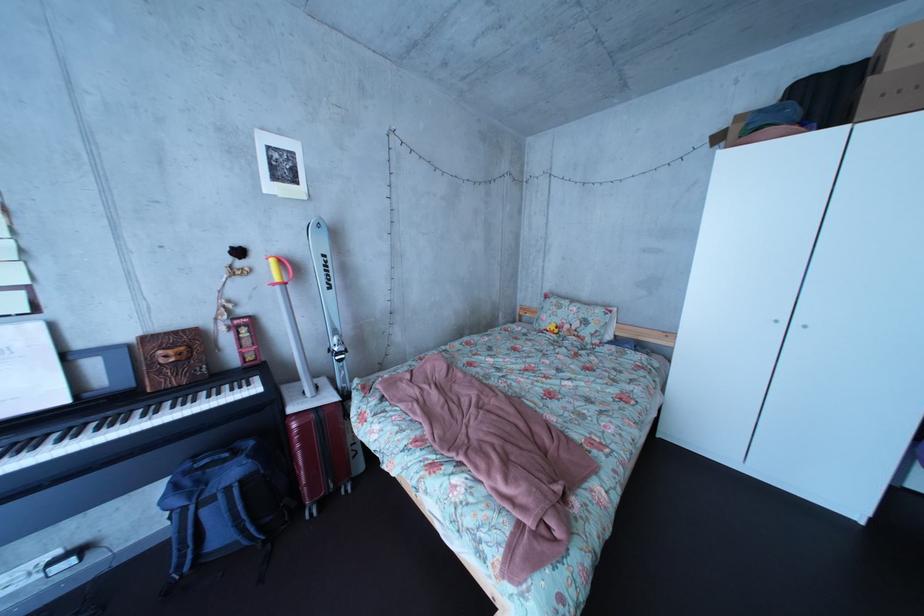
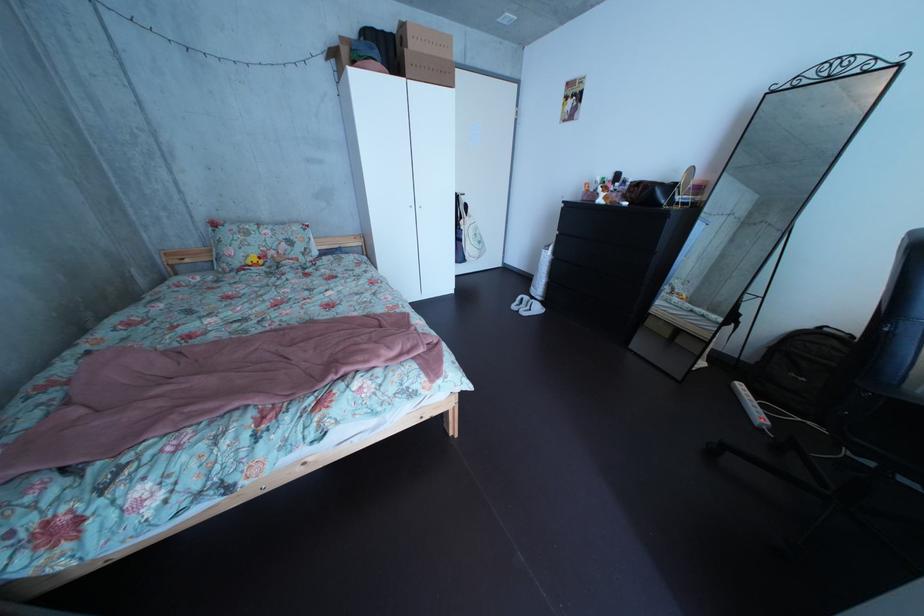
Based on the photo, the first image is from the beginning of the video and the second image is from the end. How did the camera likely rotate when shooting the video?

The camera rotated toward right-down.